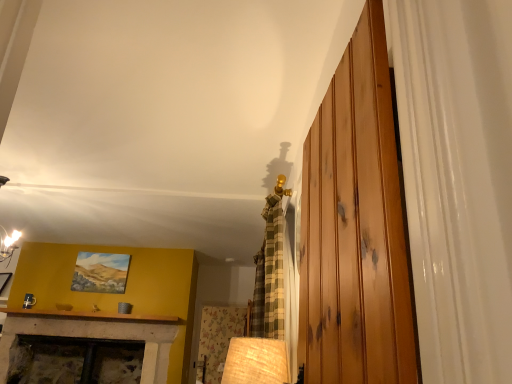
Question: In the image, is wooden at right positioned in front of or behind matte oil painting at upper left?

Choices:
 (A) behind
 (B) front

Answer: (B)

Question: Does point [x=352, y=137] appear closer or farther from the camera than point [x=75, y=281]?

Choices:
 (A) closer
 (B) farther

Answer: (A)

Question: Considering the positions of wooden at right and matte oil painting at upper left in the image, is wooden at right wider or thinner than matte oil painting at upper left?

Choices:
 (A) wide
 (B) thin

Answer: (A)

Question: Based on their sizes in the image, would you say matte oil painting at upper left is bigger or smaller than wooden at right?

Choices:
 (A) big
 (B) small

Answer: (B)

Question: From a real-world perspective, relative to wooden at right, is matte oil painting at upper left vertically above or below?

Choices:
 (A) above
 (B) below

Answer: (A)

Question: Would you say matte oil painting at upper left is inside or outside wooden at right?

Choices:
 (A) inside
 (B) outside

Answer: (B)

Question: From their relative heights in the image, would you say matte oil painting at upper left is taller or shorter than wooden at right?

Choices:
 (A) tall
 (B) short

Answer: (B)